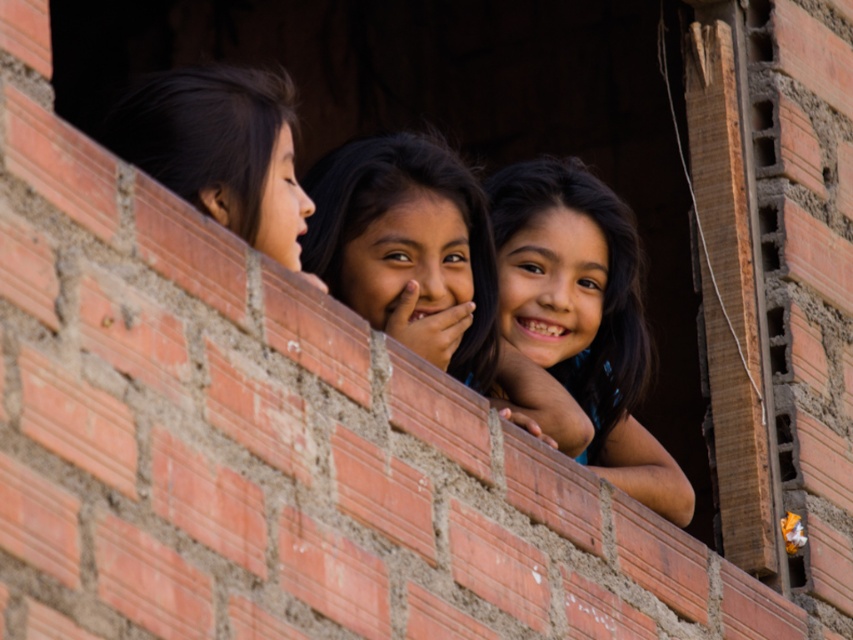
You are a photographer trying to capture the two girls in the scene. You need to arrange them so that the smooth skin child at center is to the right of the black hair at left. Is their current positioning already suitable for this requirement?

Yes, the smooth skin child at center is already positioned on the right side of the black hair at left, so their current arrangement meets the requirement.

You are a photographer trying to capture a candid shot of the two girls with dark brown hair at center and black hair at left. Since you want to ensure both are visible in the frame, which girl should you focus on to include both in the photo?

You should focus on the dark brown hair at center because it occupies less space than the black hair at left, so positioning the camera to include the larger black hair at left will naturally include the smaller dark brown hair at center in the frame as well.